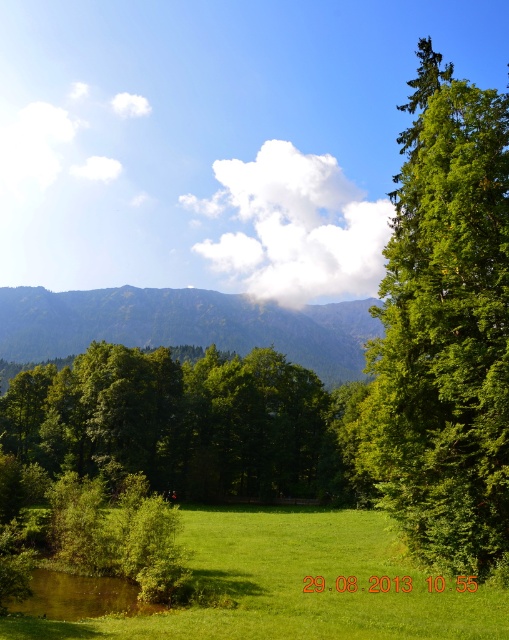
Question: Is green grassy field at lower center above green forested mountain at center?

Choices:
 (A) no
 (B) yes

Answer: (A)

Question: Considering the relative positions of green leafy tree at center and green grassy field at lower center in the image provided, where is green leafy tree at center located with respect to green grassy field at lower center?

Choices:
 (A) above
 (B) below

Answer: (A)

Question: Which of the following is the closest to the observer?

Choices:
 (A) green grassy field at lower center
 (B) green leafy tree at center

Answer: (A)

Question: Which object is closer to the camera taking this photo?

Choices:
 (A) green grassy field at lower center
 (B) green forested mountain at center
 (C) green leafy tree at center

Answer: (A)

Question: Which point is closer to the camera taking this photo?

Choices:
 (A) (356, 314)
 (B) (51, 628)
 (C) (241, 396)

Answer: (B)

Question: Is green leafy tree at center bigger than green grassy field at lower center?

Choices:
 (A) yes
 (B) no

Answer: (A)